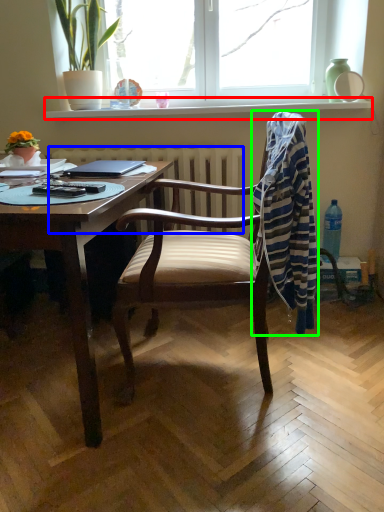
Question: Which object is the closest to the window sill (highlighted by a red box)? Choose among these: radiator (highlighted by a blue box) or laundry (highlighted by a green box).

Choices:
 (A) radiator
 (B) laundry

Answer: (A)